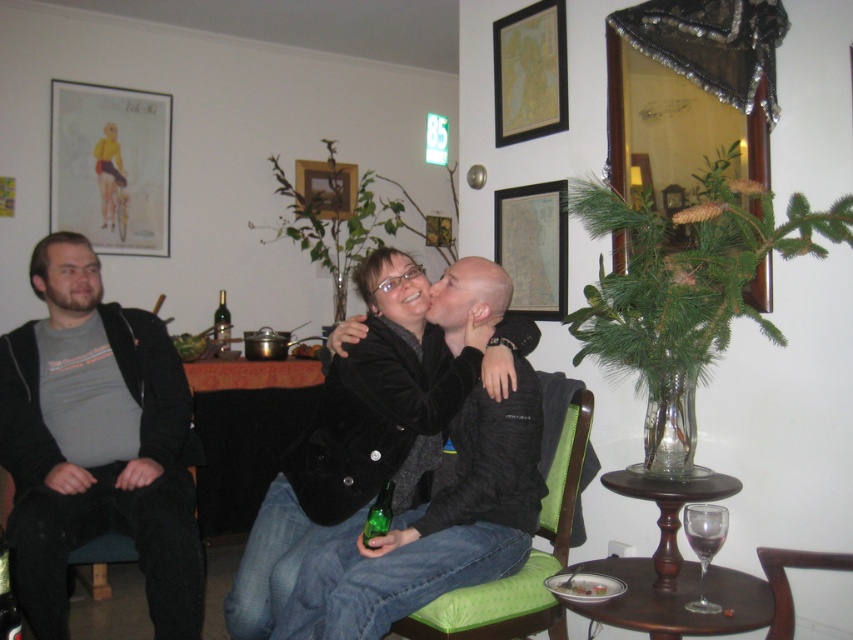
Is velvet black jacket at center bigger than green glass bottle at lower center?

Indeed, velvet black jacket at center has a larger size compared to green glass bottle at lower center.

Which of these two, velvet black jacket at center or green glass bottle at lower center, stands shorter?

Standing shorter between the two is green glass bottle at lower center.

Image resolution: width=853 pixels, height=640 pixels. What do you see at coordinates (339, 445) in the screenshot? I see `velvet black jacket at center` at bounding box center [339, 445].

Locate an element on the screen. Image resolution: width=853 pixels, height=640 pixels. velvet black jacket at center is located at coordinates (339, 445).

You are a GUI agent. You are given a task and a screenshot of the screen. Output one action in this format:
    pyautogui.click(x=<x>, y=<y>)
    Task: Click on the brown leather armchair at lower right
    This screenshot has width=853, height=640.
    Given the screenshot: What is the action you would take?
    pyautogui.click(x=787, y=580)

Does brown leather armchair at lower right lie in front of green glass bottle at lower center?

Yes, brown leather armchair at lower right is in front of green glass bottle at lower center.

Between point (776, 628) and point (392, 490), which one is positioned behind?

Positioned behind is point (392, 490).

Where is `brown leather armchair at lower right`? The image size is (853, 640). brown leather armchair at lower right is located at coordinates pyautogui.click(x=787, y=580).

Where is `green fabric armchair at center`? The width and height of the screenshot is (853, 640). green fabric armchair at center is located at coordinates (538, 532).

Is green fabric armchair at center positioned in front of green glass bottle at center?

Yes, green fabric armchair at center is in front of green glass bottle at center.

Who is more distant from viewer, (489,637) or (225,304)?

Point (225,304)

Find the location of `green fabric armchair at center`. green fabric armchair at center is located at coordinates (538, 532).